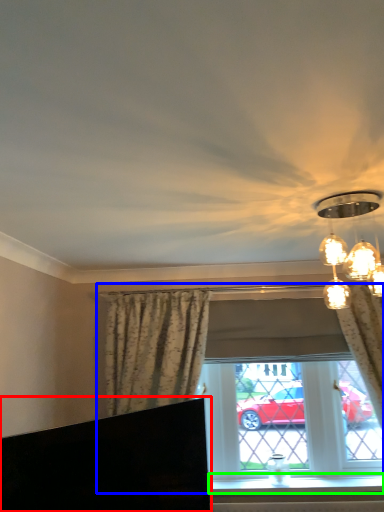
Question: Which object is the farthest from furniture (highlighted by a red box)? Choose among these: window (highlighted by a blue box) or window sill (highlighted by a green box).

Choices:
 (A) window
 (B) window sill

Answer: (B)